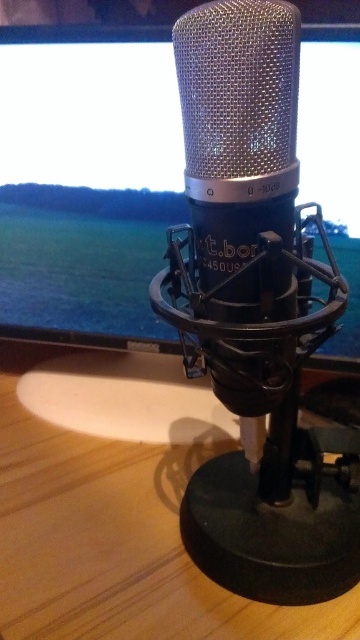
Question: Can you confirm if matte black monitor at center is smaller than wooden table at center?

Choices:
 (A) yes
 (B) no

Answer: (A)

Question: Observing the image, what is the correct spatial positioning of matte black monitor at center in reference to wooden table at center?

Choices:
 (A) left
 (B) right

Answer: (A)

Question: Can you confirm if matte black monitor at center is positioned to the left of wooden table at center?

Choices:
 (A) yes
 (B) no

Answer: (A)

Question: Which point appears farthest from the camera in this image?

Choices:
 (A) tap(65, 56)
 (B) tap(168, 525)

Answer: (A)

Question: Which of the following is the farthest from the observer?

Choices:
 (A) wooden table at center
 (B) matte black monitor at center

Answer: (B)